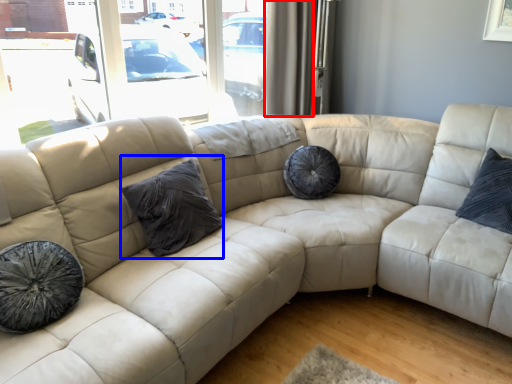
Question: Among these objects, which one is nearest to the camera, curtain (highlighted by a red box) or pillow (highlighted by a blue box)?

Choices:
 (A) curtain
 (B) pillow

Answer: (B)